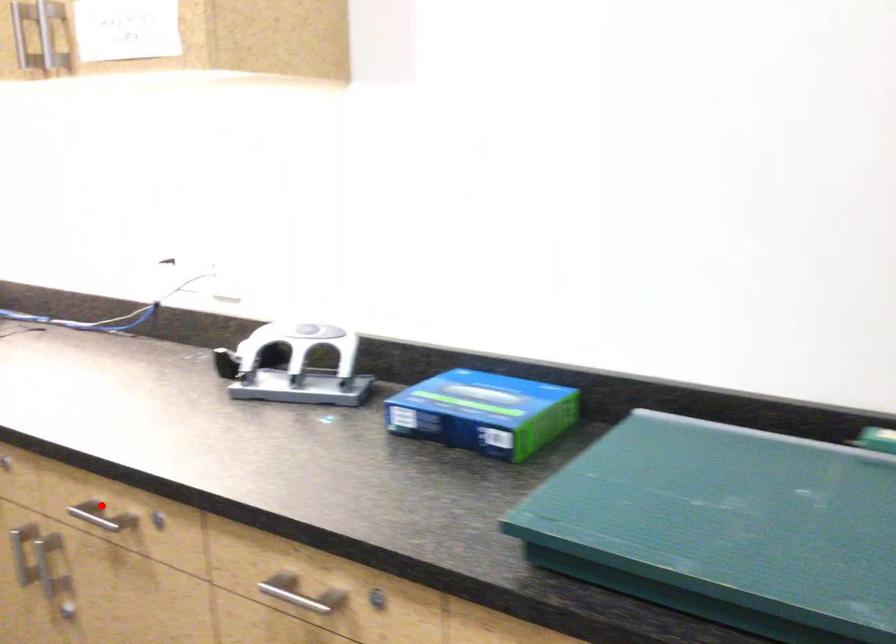
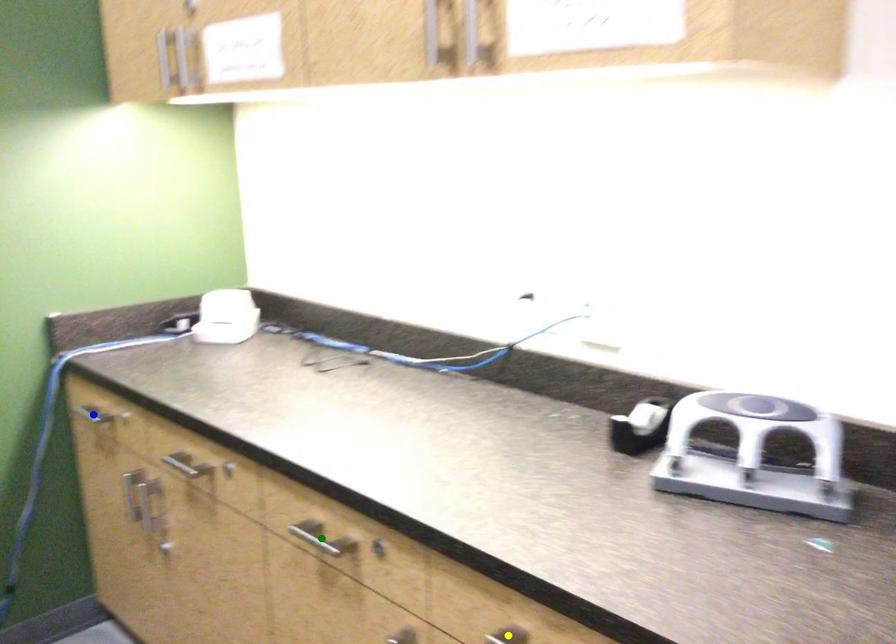
Question: I am providing you with two images of the same scene from different viewpoints. A red point is marked on the first image. You are given multiple points on the second image. Which point in image 2 represents the same 3d spot as the red point in image 1?

Choices:
 (A) blue point
 (B) yellow point
 (C) green point

Answer: (B)